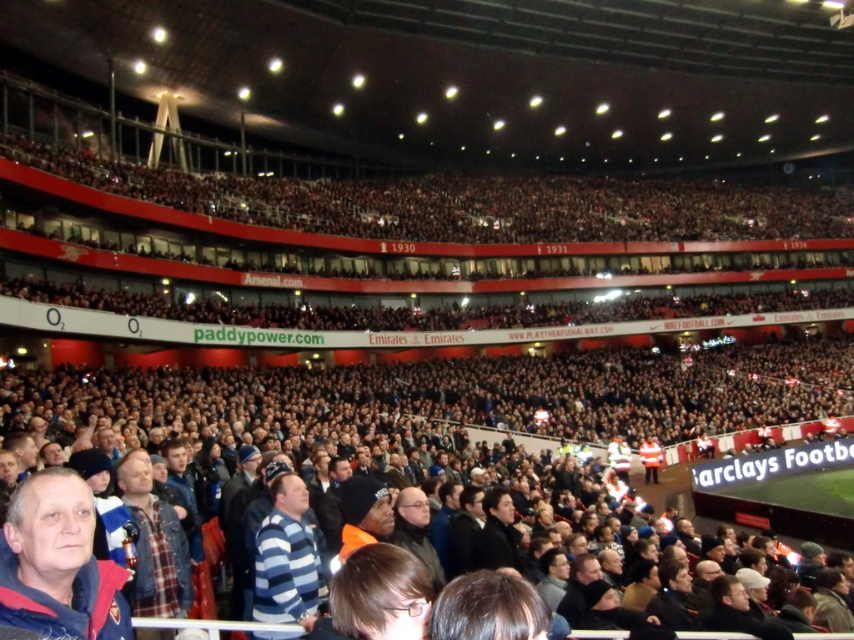
Is striped cotton shirt at center bigger than dark gray jacket at center?

Yes, striped cotton shirt at center is bigger than dark gray jacket at center.

This screenshot has height=640, width=854. I want to click on striped cotton shirt at center, so click(x=287, y=557).

Is blue plaid shirt at lower left taller than black leather jacket at center?

Correct, blue plaid shirt at lower left is much taller as black leather jacket at center.

Does point (112, 600) come farther from viewer compared to point (496, 522)?

No.

Is point (109, 637) more distant than point (487, 528)?

No, it is not.

Find the location of a particular element. blue plaid shirt at lower left is located at coordinates (57, 563).

Who is taller, blue plaid shirt at lower left or striped cotton shirt at center?

blue plaid shirt at lower left is taller.

Is point (115, 600) closer to viewer compared to point (261, 632)?

Yes, point (115, 600) is in front of point (261, 632).

Find the location of a particular element. The width and height of the screenshot is (854, 640). blue plaid shirt at lower left is located at coordinates (57, 563).